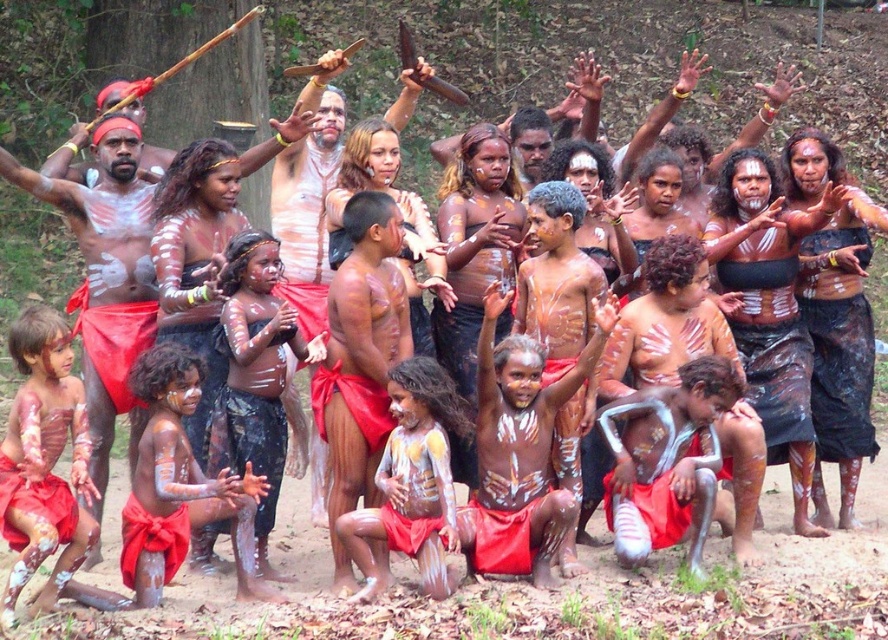
Question: Is matte red loincloth at left above white matte leg at lower center?

Choices:
 (A) yes
 (B) no

Answer: (A)

Question: Which point is farther from the camera taking this photo?

Choices:
 (A) (117, 291)
 (B) (666, 486)

Answer: (A)

Question: Which point appears closest to the camera in this image?

Choices:
 (A) (141, 292)
 (B) (646, 488)

Answer: (B)

Question: Among these points, which one is nearest to the camera?

Choices:
 (A) (38, 180)
 (B) (647, 500)

Answer: (B)

Question: Does matte red loincloth at left have a greater width compared to white matte leg at lower center?

Choices:
 (A) no
 (B) yes

Answer: (B)

Question: Can you confirm if matte red loincloth at left is smaller than white matte leg at lower center?

Choices:
 (A) no
 (B) yes

Answer: (A)